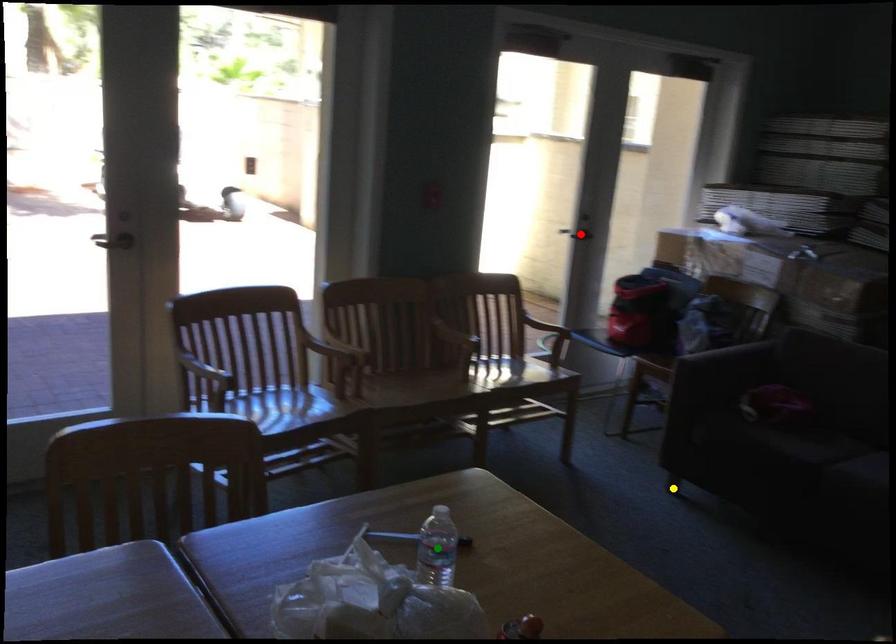
Order these from nearest to farthest:
yellow point, green point, red point

red point, yellow point, green point